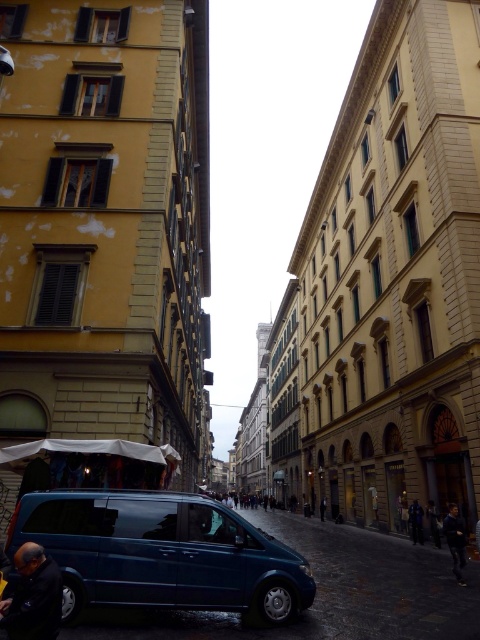
Is the position of shiny blue van at center less distant than that of dark blue fabric jacket at lower left?

No, shiny blue van at center is behind dark blue fabric jacket at lower left.

Is shiny blue van at center wider than dark blue fabric jacket at lower left?

Indeed, shiny blue van at center has a greater width compared to dark blue fabric jacket at lower left.

What are the coordinates of `shiny blue van at center` in the screenshot? It's located at (370, 586).

Can you confirm if metallic blue van at center is positioned above dark blue fabric jacket at lower left?

Incorrect, metallic blue van at center is not positioned above dark blue fabric jacket at lower left.

Does metallic blue van at center have a greater height compared to dark blue fabric jacket at lower left?

Indeed, metallic blue van at center has a greater height compared to dark blue fabric jacket at lower left.

Describe the element at coordinates (162, 554) in the screenshot. I see `metallic blue van at center` at that location.

Identify the location of metallic blue van at center. (162, 554).

Which is above, metallic blue van at center or shiny blue van at center?

Positioned higher is metallic blue van at center.

What do you see at coordinates (162, 554) in the screenshot? This screenshot has width=480, height=640. I see `metallic blue van at center` at bounding box center [162, 554].

Locate an element on the screen. metallic blue van at center is located at coordinates (162, 554).

At what (x,y) coordinates should I click in order to perform the action: click on metallic blue van at center. Please return your answer as a coordinate pair (x, y). The image size is (480, 640). Looking at the image, I should click on (162, 554).